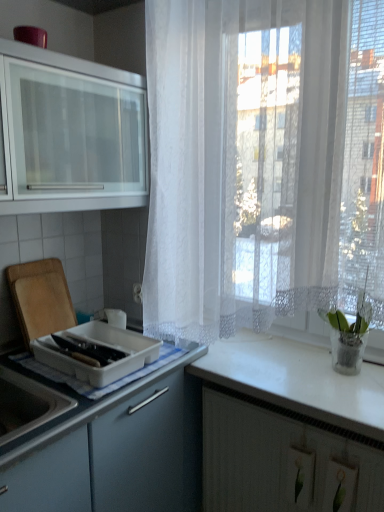
Identify the location of vacant space to the left of green glass vase at right. Image resolution: width=384 pixels, height=512 pixels. (284, 370).